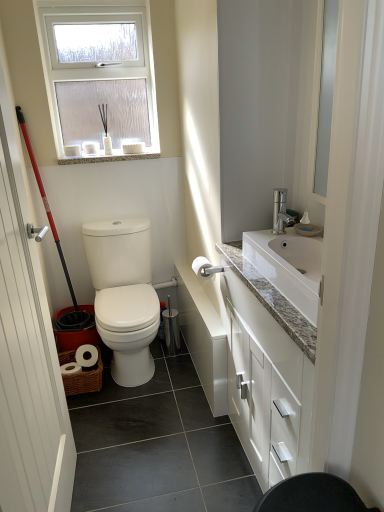
Question: Considering the relative sizes of white matte toilet paper at center and white wooden door at left in the image provided, is white matte toilet paper at center taller than white wooden door at left?

Choices:
 (A) yes
 (B) no

Answer: (B)

Question: Is white matte toilet paper at center in contact with white wooden door at left?

Choices:
 (A) yes
 (B) no

Answer: (B)

Question: Is white matte toilet paper at center outside white wooden door at left?

Choices:
 (A) no
 (B) yes

Answer: (B)

Question: Is white matte toilet paper at center bigger than white wooden door at left?

Choices:
 (A) yes
 (B) no

Answer: (B)

Question: Is the position of white matte toilet paper at center more distant than that of white wooden door at left?

Choices:
 (A) yes
 (B) no

Answer: (A)

Question: Is white glossy cabinet at right situated inside white frosted glass window at upper center or outside?

Choices:
 (A) outside
 (B) inside

Answer: (A)

Question: From the image's perspective, is white glossy cabinet at right above or below white frosted glass window at upper center?

Choices:
 (A) above
 (B) below

Answer: (B)

Question: Visually, is white glossy cabinet at right positioned to the left or to the right of white frosted glass window at upper center?

Choices:
 (A) right
 (B) left

Answer: (A)

Question: Looking at their shapes, would you say white glossy cabinet at right is wider or thinner than white frosted glass window at upper center?

Choices:
 (A) wide
 (B) thin

Answer: (A)

Question: In terms of width, does white matte toilet paper at center look wider or thinner when compared to white frosted glass window at upper center?

Choices:
 (A) wide
 (B) thin

Answer: (A)

Question: In terms of size, does white matte toilet paper at center appear bigger or smaller than white frosted glass window at upper center?

Choices:
 (A) small
 (B) big

Answer: (A)

Question: Does point (195, 263) appear closer or farther from the camera than point (96, 67)?

Choices:
 (A) farther
 (B) closer

Answer: (B)

Question: Relative to white frosted glass window at upper center, is white matte toilet paper at center in front or behind?

Choices:
 (A) behind
 (B) front

Answer: (B)

Question: Is white glossy cabinet at right taller or shorter than white matte toilet paper at center?

Choices:
 (A) short
 (B) tall

Answer: (B)

Question: Is point (246, 389) positioned closer to the camera than point (195, 268)?

Choices:
 (A) closer
 (B) farther

Answer: (A)